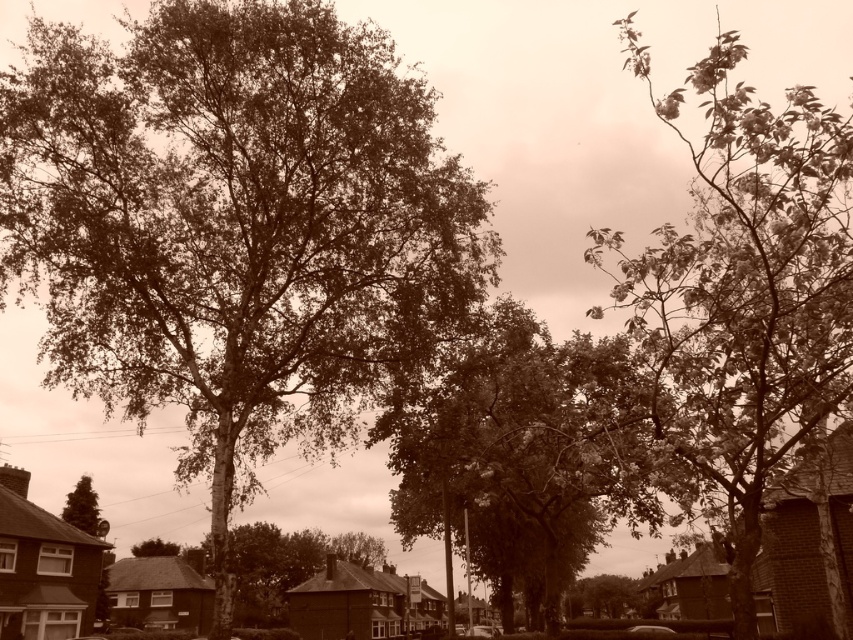
Which is in front, point (276, 348) or point (734, 353)?

Point (734, 353) is more forward.

Does green leafy tree at center appear over green leafy tree at upper right?

No, green leafy tree at center is not above green leafy tree at upper right.

The height and width of the screenshot is (640, 853). What are the coordinates of `green leafy tree at center` in the screenshot? It's located at (234, 227).

Image resolution: width=853 pixels, height=640 pixels. In order to click on green leafy tree at center in this screenshot , I will do `click(234, 227)`.

What do you see at coordinates (234, 227) in the screenshot?
I see `green leafy tree at center` at bounding box center [234, 227].

Measure the distance from green leafy tree at center to green leafy tree at lower left.

The distance of green leafy tree at center from green leafy tree at lower left is 49.71 meters.

Between point (404, 280) and point (138, 554), which one is positioned in front?

Point (404, 280)

Identify the location of green leafy tree at center. (234, 227).

Which is more to the left, green leafy tree at upper right or green leafy tree at lower left?

Positioned to the left is green leafy tree at lower left.

Is point (657, 429) closer to camera compared to point (178, 545)?

Yes, it is in front of point (178, 545).

Which is behind, point (692, 257) or point (149, 547)?

The point (149, 547) is more distant.

This screenshot has width=853, height=640. Identify the location of green leafy tree at upper right. (741, 292).